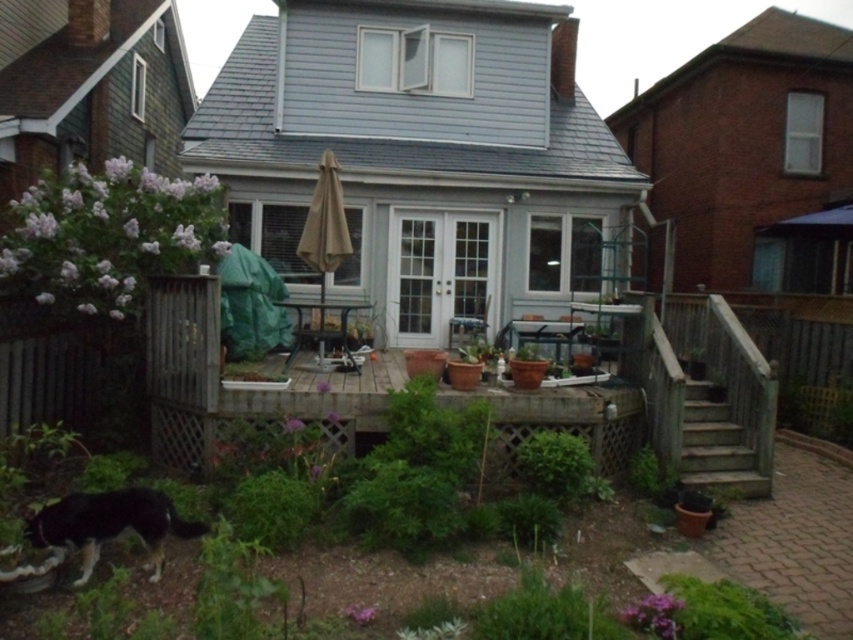
You are a visitor arriving at this house and need to find the entrance. You see a black fur dog at lower left and wooden stairs at lower right. Which object is closer to the entrance?

The black fur dog at lower left is closer to the entrance because it occupies less space than the wooden stairs at lower right, indicating it is nearer to the viewer.

You are standing at the entrance of the house and want to go down to the garden area. Which direction should you head towards relative to the wooden stairs at lower right?

Since the wooden stairs at lower right is located at point (721, 445), you should head towards the lower right direction to reach the garden area from the entrance.